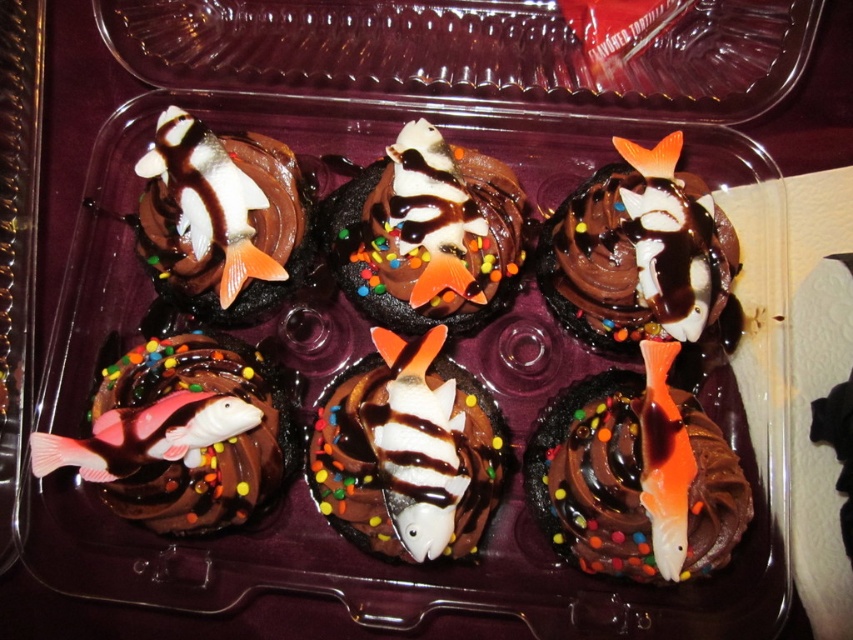
Between chocolate matte fish at center and matte chocolate fish at center, which one is positioned lower?

Positioned lower is chocolate matte fish at center.

Can you confirm if chocolate matte fish at center is smaller than matte chocolate fish at center?

Actually, chocolate matte fish at center might be larger than matte chocolate fish at center.

The image size is (853, 640). Find the location of `chocolate matte fish at center`. chocolate matte fish at center is located at coordinates (428, 234).

Between point (712, 61) and point (532, 477), which one is positioned in front?

Point (532, 477) is more forward.

Is point (550, 26) in front of point (578, 412)?

No, (550, 26) is further to viewer.

You are a GUI agent. You are given a task and a screenshot of the screen. Output one action in this format:
    pyautogui.click(x=<x>, y=<y>)
    Task: Click on the transparent plastic tray at upper center
    Image resolution: width=853 pixels, height=640 pixels.
    Given the screenshot: What is the action you would take?
    pyautogui.click(x=477, y=51)

You are a GUI agent. You are given a task and a screenshot of the screen. Output one action in this format:
    pyautogui.click(x=<x>, y=<y>)
    Task: Click on the transparent plastic tray at upper center
    The height and width of the screenshot is (640, 853).
    Given the screenshot: What is the action you would take?
    pyautogui.click(x=477, y=51)

Does point (584, 392) lie in front of point (244, 422)?

That is False.

From the picture: Can you confirm if chocolate matte cake at center is positioned to the left of pink matte fish at center?

Incorrect, chocolate matte cake at center is not on the left side of pink matte fish at center.

Measure the distance between chocolate matte cake at center and camera.

3.36 feet

Find the location of a particular element. This screenshot has height=640, width=853. chocolate matte cake at center is located at coordinates pyautogui.click(x=593, y=476).